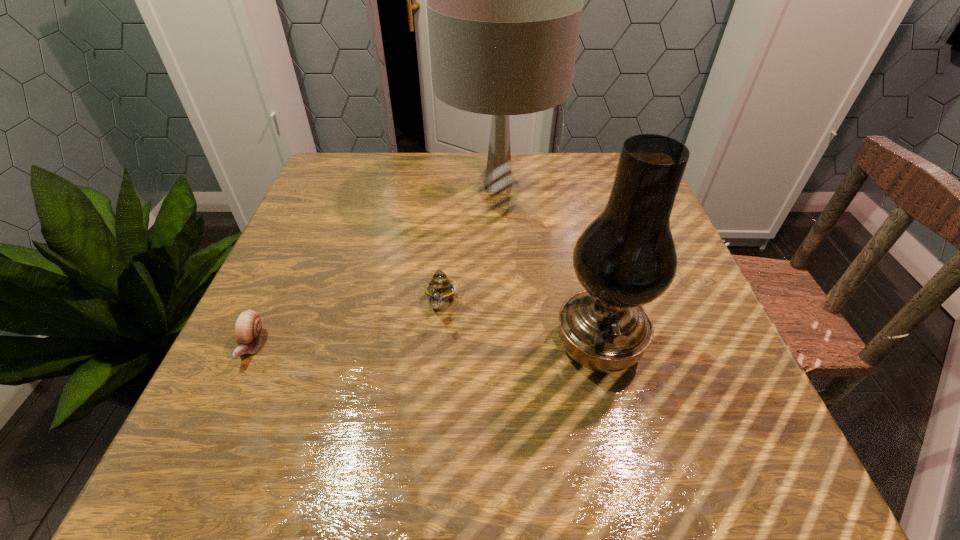
This screenshot has width=960, height=540. I want to click on free spot at the far right corner of the desktop, so click(613, 172).

Locate an element on the screen. The image size is (960, 540). empty space between the lampshade and the oil lamp is located at coordinates (548, 266).

The width and height of the screenshot is (960, 540). In order to click on free space between the lampshade and the shortest object in this screenshot , I will do click(x=374, y=266).

You are a GUI agent. You are given a task and a screenshot of the screen. Output one action in this format:
    pyautogui.click(x=<x>, y=<y>)
    Task: Click on the empty space between the right escargot and the farthest object
    This screenshot has width=960, height=540.
    Given the screenshot: What is the action you would take?
    pyautogui.click(x=470, y=246)

Image resolution: width=960 pixels, height=540 pixels. I want to click on vacant space that's between the oil lamp and the shortest object, so click(425, 345).

Identify the location of vacant space that's between the shortest object and the right escargot. This screenshot has width=960, height=540. (347, 326).

The image size is (960, 540). In order to click on free space between the farthest object and the left escargot in this screenshot , I will do `click(374, 266)`.

This screenshot has width=960, height=540. Find the location of `free space between the oil lamp and the taller escargot`. free space between the oil lamp and the taller escargot is located at coordinates (520, 326).

Image resolution: width=960 pixels, height=540 pixels. I want to click on free spot between the farthest object and the taller escargot, so click(470, 246).

I want to click on vacant area between the right escargot and the oil lamp, so click(520, 326).